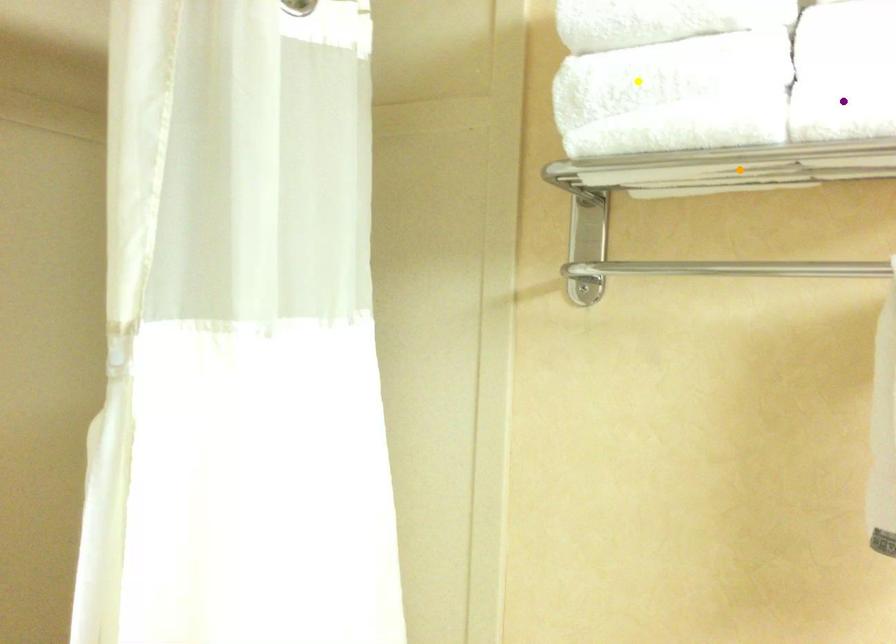
Order these from nearest to farthest:
1. orange point
2. yellow point
3. purple point

orange point, yellow point, purple point